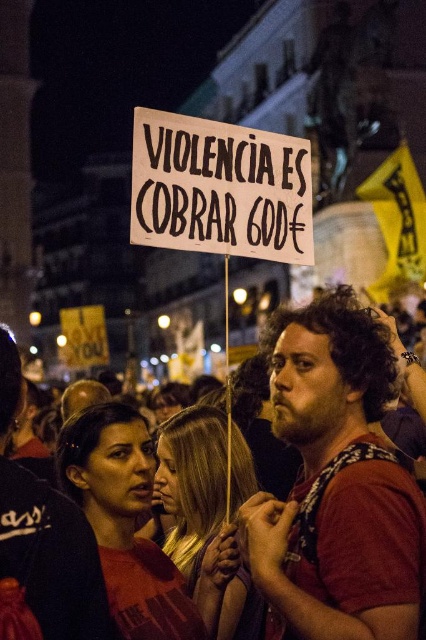
Between dark red t-shirt at center and white paper sign at center, which one appears on the left side from the viewer's perspective?

Positioned to the left is white paper sign at center.

Does dark red t-shirt at center have a lesser width compared to white paper sign at center?

No.

The width and height of the screenshot is (426, 640). What do you see at coordinates (336, 484) in the screenshot?
I see `dark red t-shirt at center` at bounding box center [336, 484].

Where is `dark red t-shirt at center`? Image resolution: width=426 pixels, height=640 pixels. dark red t-shirt at center is located at coordinates (336, 484).

Who is higher up, red shirt at center or white paper sign at center?

white paper sign at center

Does red shirt at center have a lesser height compared to white paper sign at center?

Incorrect, red shirt at center's height does not fall short of white paper sign at center's.

Does point (336, 401) come in front of point (190, 129)?

No, it is not.

Image resolution: width=426 pixels, height=640 pixels. What are the coordinates of `red shirt at center` in the screenshot? It's located at (336, 486).

Does dark red t-shirt at center appear under red shirt at center?

Correct, dark red t-shirt at center is located below red shirt at center.

Between point (319, 560) and point (330, 529), which one is positioned behind?

Positioned behind is point (319, 560).

Which is in front, point (379, 506) or point (290, 550)?

Positioned in front is point (379, 506).

Locate an element on the screen. This screenshot has height=640, width=426. dark red t-shirt at center is located at coordinates (336, 484).